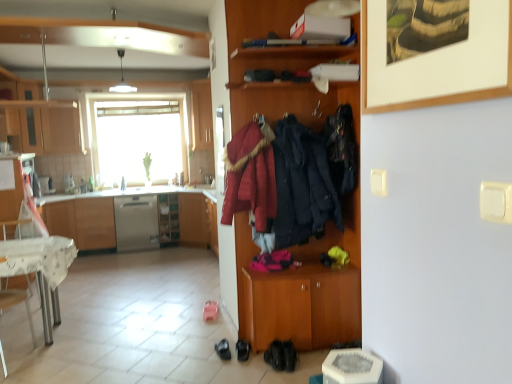
This screenshot has width=512, height=384. What are the coordinates of `white glossy desk at lower left` in the screenshot? It's located at [x=40, y=269].

This screenshot has width=512, height=384. Describe the element at coordinates (137, 136) in the screenshot. I see `transparent glass window at center` at that location.

Describe the element at coordinates (168, 219) in the screenshot. I see `wooden cabinet at center` at that location.

The width and height of the screenshot is (512, 384). Identify the location of black leather shoes at lower center, which appears as the first footwear when viewed from the right. (289, 355).

Describe the element at coordinates (83, 221) in the screenshot. The image size is (512, 384). I see `satin wood cabinet at left, the 3th cabinetry from the left` at that location.

Identify the location of white glossy desk at lower left. (40, 269).

Is the position of wooden framed artwork at upper right less distant than that of black leather shoes at lower center, acting as the second footwear starting from the left?

Yes, wooden framed artwork at upper right is in front of black leather shoes at lower center, acting as the second footwear starting from the left.

Considering the positions of point (426, 102) and point (243, 354), is point (426, 102) closer or farther from the camera than point (243, 354)?

Point (426, 102).

Is wooden framed artwork at upper right to the left of black leather shoes at lower center, acting as the second footwear starting from the left, from the viewer's perspective?

No.

Who is more distant, velvet-like dark blue coat at center, which ranks as the 2th clothing in left-to-right order, or white glossy pendant light at upper center?

white glossy pendant light at upper center.

From a real-world perspective, which is physically below, velvet-like dark blue coat at center, which ranks as the 2th clothing in left-to-right order, or white glossy pendant light at upper center?

From a 3D spatial view, velvet-like dark blue coat at center, which ranks as the 2th clothing in left-to-right order, is below.

Are velvet-like dark blue coat at center, which ranks as the 2th clothing in left-to-right order, and white glossy pendant light at upper center located far from each other?

Indeed, velvet-like dark blue coat at center, which ranks as the 2th clothing in left-to-right order, is not near white glossy pendant light at upper center.

Is wooden cabinet at center thinner than wooden framed artwork at upper right?

No, wooden cabinet at center is not thinner than wooden framed artwork at upper right.

Is wooden cabinet at center looking in the opposite direction of wooden framed artwork at upper right?

No, wooden cabinet at center's orientation is not away from wooden framed artwork at upper right.

From the picture: From the image's perspective, is wooden cabinet at center on wooden framed artwork at upper right?

Incorrect, from the image's perspective, wooden cabinet at center is lower than wooden framed artwork at upper right.

Is wooden cabinet at center positioned far away from wooden framed artwork at upper right?

Yes.

Is white glossy pendant light at upper center oriented away from white glossy desk at lower left?

No, white glossy pendant light at upper center is not facing away from white glossy desk at lower left.

You are a GUI agent. You are given a task and a screenshot of the screen. Output one action in this format:
    pyautogui.click(x=<x>, y=<y>)
    Task: Click on the lamp behind the white glossy desk at lower left
    The image size is (512, 384).
    Given the screenshot: What is the action you would take?
    pyautogui.click(x=122, y=78)

Between white glossy pendant light at upper center and white glossy desk at lower left, which one has larger width?

white glossy desk at lower left.

Is white glossy pendant light at upper center closer to camera compared to white glossy desk at lower left?

No, white glossy pendant light at upper center is further to the viewer.

In terms of size, does black leather shoes at lower center, which is counted as the 1th footwear, starting from the left, appear bigger or smaller than velvet-like dark blue coat at center, which ranks as the 2th clothing in left-to-right order?

black leather shoes at lower center, which is counted as the 1th footwear, starting from the left, is smaller than velvet-like dark blue coat at center, which ranks as the 2th clothing in left-to-right order.

Could you tell me if black leather shoes at lower center, which is counted as the third footwear, starting from the right, is turned towards velvet-like dark blue coat at center, which is counted as the second clothing, starting from the right?

No, black leather shoes at lower center, which is counted as the third footwear, starting from the right, is not facing towards velvet-like dark blue coat at center, which is counted as the second clothing, starting from the right.

Which clothing is the 2nd one when counting from the front of the black leather shoes at lower center, which is counted as the 1th footwear, starting from the left? Please provide its 2D coordinates.

[(302, 185)]

Considering the relative positions of black leather shoes at lower center, which is counted as the third footwear, starting from the right, and velvet-like dark blue coat at center, which is counted as the second clothing, starting from the right, in the image provided, is black leather shoes at lower center, which is counted as the third footwear, starting from the right, to the left or to the right of velvet-like dark blue coat at center, which is counted as the second clothing, starting from the right,?

black leather shoes at lower center, which is counted as the third footwear, starting from the right, is positioned on velvet-like dark blue coat at center, which is counted as the second clothing, starting from the right,'s left side.

Is satin wood cabinet at left, arranged as the fourth cabinetry when viewed from the front, bigger than black leather shoes at lower center, which is counted as the 1th footwear, starting from the left?

Yes, satin wood cabinet at left, arranged as the fourth cabinetry when viewed from the front, is bigger than black leather shoes at lower center, which is counted as the 1th footwear, starting from the left.

In the scene shown: Is satin wood cabinet at left, arranged as the fourth cabinetry when viewed from the front, not inside black leather shoes at lower center, which is counted as the third footwear, starting from the right?

Yes.

Does satin wood cabinet at left, which appears as the 1th cabinetry when viewed from the back, have a lesser height compared to black leather shoes at lower center, which is counted as the 1th footwear, starting from the left?

No, satin wood cabinet at left, which appears as the 1th cabinetry when viewed from the back, is not shorter than black leather shoes at lower center, which is counted as the 1th footwear, starting from the left.

Does satin wood cabinet at left, the 2th cabinetry positioned from the right, have a greater width compared to black leather shoes at lower center, which is counted as the 1th footwear, starting from the left?

Correct, the width of satin wood cabinet at left, the 2th cabinetry positioned from the right, exceeds that of black leather shoes at lower center, which is counted as the 1th footwear, starting from the left.

In the scene shown: Which of these two, black leather shoes at lower center, which appears as the first footwear when viewed from the right, or wooden coat rack at center, which is the 4th cabinetry in back-to-front order, is bigger?

With larger size is wooden coat rack at center, which is the 4th cabinetry in back-to-front order.

Does black leather shoes at lower center, which is the 3th footwear from left to right, have a lesser height compared to wooden coat rack at center, the 4th cabinetry positioned from the left?

Yes.

Is black leather shoes at lower center, which appears as the first footwear when viewed from the right, at the left side of wooden coat rack at center, the 4th cabinetry positioned from the left?

Correct, you'll find black leather shoes at lower center, which appears as the first footwear when viewed from the right, to the left of wooden coat rack at center, the 4th cabinetry positioned from the left.

Find the location of a particular element. This screenshot has height=384, width=512. the 1st footwear to the left when counting from the wooden coat rack at center, the 4th cabinetry positioned from the left is located at coordinates (289, 355).

Which footwear is the 2nd one when counting from the left side of the wooden framed artwork at upper right? Please provide its 2D coordinates.

[(243, 350)]

The width and height of the screenshot is (512, 384). Find the location of `lamp behind the velvet-like dark blue coat at center, which ranks as the 2th clothing in left-to-right order`. lamp behind the velvet-like dark blue coat at center, which ranks as the 2th clothing in left-to-right order is located at coordinates (122, 78).

Considering their positions, is satin wood cabinet at left, which appears as the 1th cabinetry when viewed from the back, positioned further to metallic silver cabinet at left, the 2th cabinetry from the left, than wooden framed artwork at upper right?

The object further to metallic silver cabinet at left, the 2th cabinetry from the left, is wooden framed artwork at upper right.

When comparing their distances from white glossy desk at lower left, does wooden coat rack at center, which is the first cabinetry in front-to-back order, or black leather shoes at lower center, which is the 3th footwear from left to right, seem further?

black leather shoes at lower center, which is the 3th footwear from left to right, is further to white glossy desk at lower left.

From the image, which object appears to be nearer to satin silver dishwasher at center, black leather shoes at lower center, which is counted as the third footwear, starting from the right, or wooden cabinet at left, arranged as the fourth cabinetry when viewed from the right?

The object closer to satin silver dishwasher at center is wooden cabinet at left, arranged as the fourth cabinetry when viewed from the right.

Which object lies nearer to the anchor point black leather shoes at lower center, which is counted as the third footwear, starting from the right, black leather shoes at lower center, which is the 3th footwear from left to right, or satin silver dishwasher at center?

black leather shoes at lower center, which is the 3th footwear from left to right, lies closer to black leather shoes at lower center, which is counted as the third footwear, starting from the right, than the other object.

Which object lies further to the anchor point velvet-like red coat at center, placed as the 1th clothing when sorted from left to right, transparent glass window at center or black leather shoes at lower center, which is counted as the third footwear, starting from the right?

transparent glass window at center.

Considering their positions, is metallic silver cabinet at left, the 3th cabinetry when ordered from back to front, positioned further to wooden coat rack at center, the 4th cabinetry positioned from the left, than black leather shoes at lower center, acting as the 2th footwear starting from the right?

Among the two, metallic silver cabinet at left, the 3th cabinetry when ordered from back to front, is located further to wooden coat rack at center, the 4th cabinetry positioned from the left.

Based on their spatial positions, is transparent glass window at center or wooden cabinet at left, arranged as the fourth cabinetry when viewed from the right, further from wooden framed artwork at upper right?

transparent glass window at center is positioned further to the anchor wooden framed artwork at upper right.

Based on the photo, when comparing their distances from wooden framed artwork at upper right, does dark blue fabric jacket at center, arranged as the 1th clothing when viewed from the right, or transparent glass window at center seem closer?

dark blue fabric jacket at center, arranged as the 1th clothing when viewed from the right, is closer to wooden framed artwork at upper right.

At what (x,y) coordinates should I click in order to perform the action: click on cabinetry between wooden framed artwork at upper right and black leather shoes at lower center, which is counted as the third footwear, starting from the right, in the front-back direction. Please return your answer as a coordinate pair (x, y). This screenshot has width=512, height=384. Looking at the image, I should click on (298, 294).

The height and width of the screenshot is (384, 512). In order to click on clothing located between velvet-like dark blue coat at center, which ranks as the 2th clothing in left-to-right order, and satin silver dishwasher at center in the depth direction in this screenshot , I will do click(341, 149).

Find the location of a particular element. lamp positioned between wooden coat rack at center, the 1th cabinetry when ordered from right to left, and satin wood cabinet at left, which appears as the 1th cabinetry when viewed from the back, from near to far is located at coordinates (122, 78).

Locate an element on the screen. The height and width of the screenshot is (384, 512). lamp positioned between black leather shoes at lower center, acting as the 2th footwear starting from the right, and wooden cabinet at center from near to far is located at coordinates (122, 78).